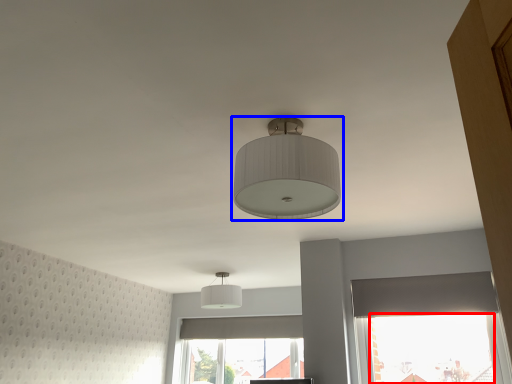
Question: Which point is closer to the camera, window screen (highlighted by a red box) or lamp (highlighted by a blue box)?

Choices:
 (A) window screen
 (B) lamp

Answer: (B)